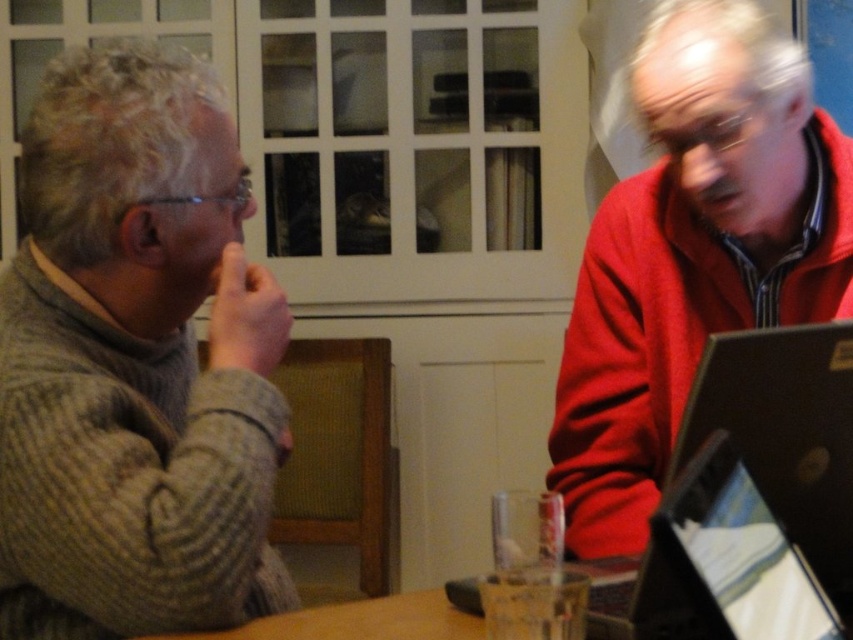
This screenshot has height=640, width=853. I want to click on knitted gray sweater at left, so click(135, 362).